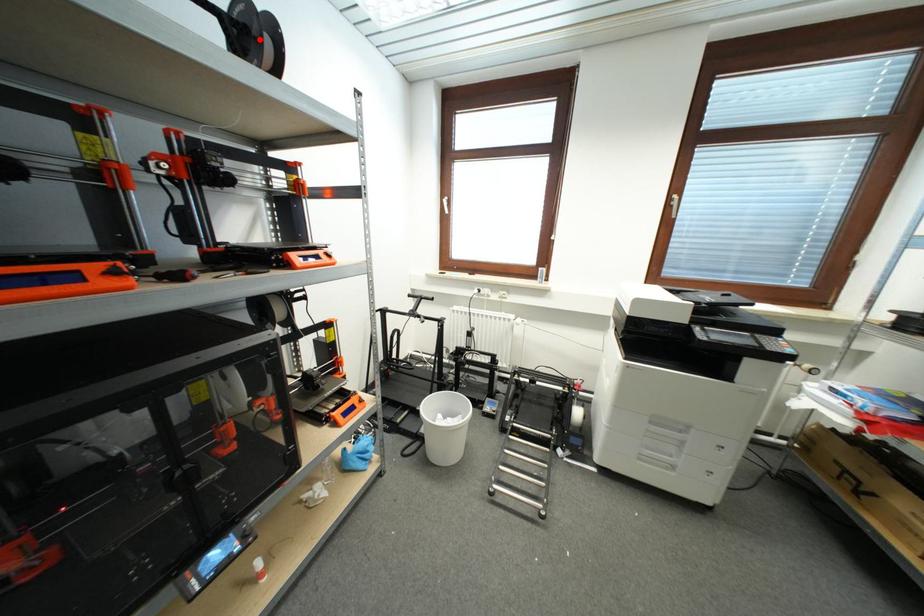
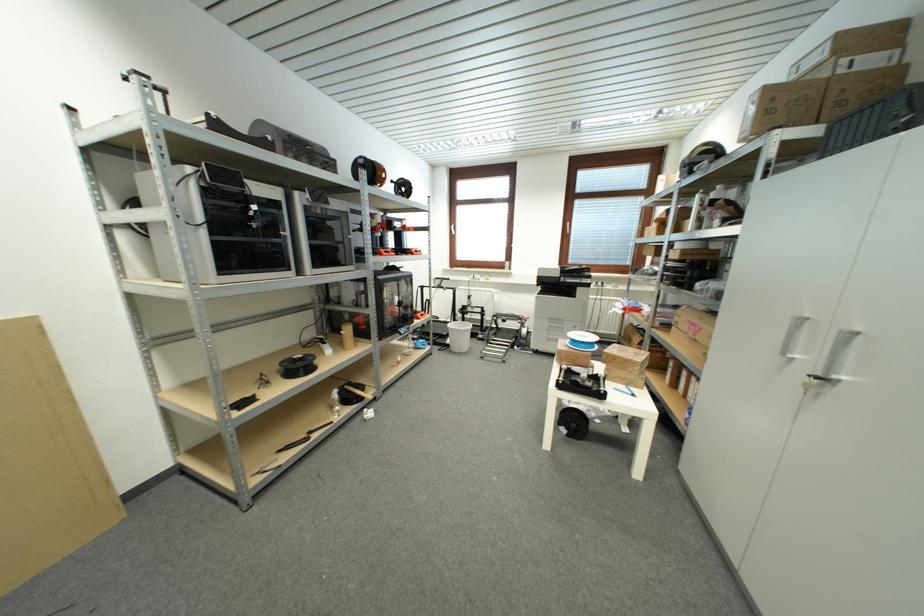
Find the pixel in the second image that matches the highlighted location in the first image.

(408, 190)